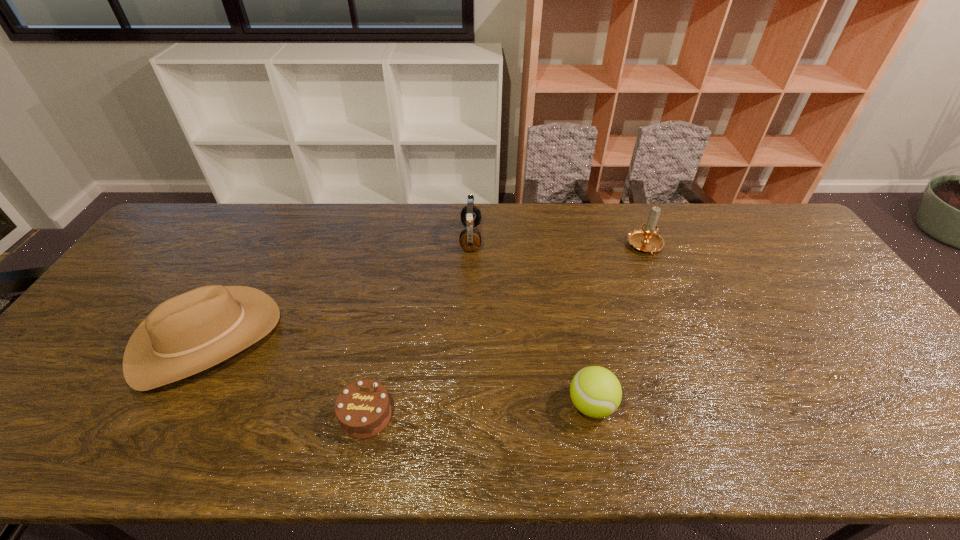
Find the location of a particular element. Image resolution: width=960 pixels, height=540 pixels. empty space that is in between the second object from left to right and the headset is located at coordinates (419, 327).

In order to click on vacant point located between the third object from left to right and the leftmost object in this screenshot , I will do `click(339, 288)`.

Locate an element on the screen. vacant area that lies between the third object from left to right and the second object from right to left is located at coordinates (531, 321).

Locate which object is the third closest to the shortest object. Please provide its 2D coordinates. Your answer should be formatted as a tuple, i.e. [(x, y)], where the tuple contains the x and y coordinates of a point satisfying the conditions above.

[(470, 239)]

Identify which object is the closest to the third object from right to left. Please provide its 2D coordinates. Your answer should be formatted as a tuple, i.e. [(x, y)], where the tuple contains the x and y coordinates of a point satisfying the conditions above.

[(646, 239)]

At what (x,y) coordinates should I click in order to perform the action: click on free location that satisfies the following two spatial constraints: 1. on the back side of the rightmost object; 2. on the ear cups of the third object from left to right. Please return your answer as a coordinate pair (x, y). The image size is (960, 540). Looking at the image, I should click on (641, 238).

Image resolution: width=960 pixels, height=540 pixels. In order to click on vacant space that satisfies the following two spatial constraints: 1. on the ear cups of the headset; 2. on the right side of the fourth object from left to right in this screenshot , I will do `click(467, 405)`.

You are a GUI agent. You are given a task and a screenshot of the screen. Output one action in this format:
    pyautogui.click(x=<x>, y=<y>)
    Task: Click on the vacant space that satisfies the following two spatial constraints: 1. on the back side of the candle; 2. on the right side of the second object from left to right
    
    Given the screenshot: What is the action you would take?
    pyautogui.click(x=400, y=247)